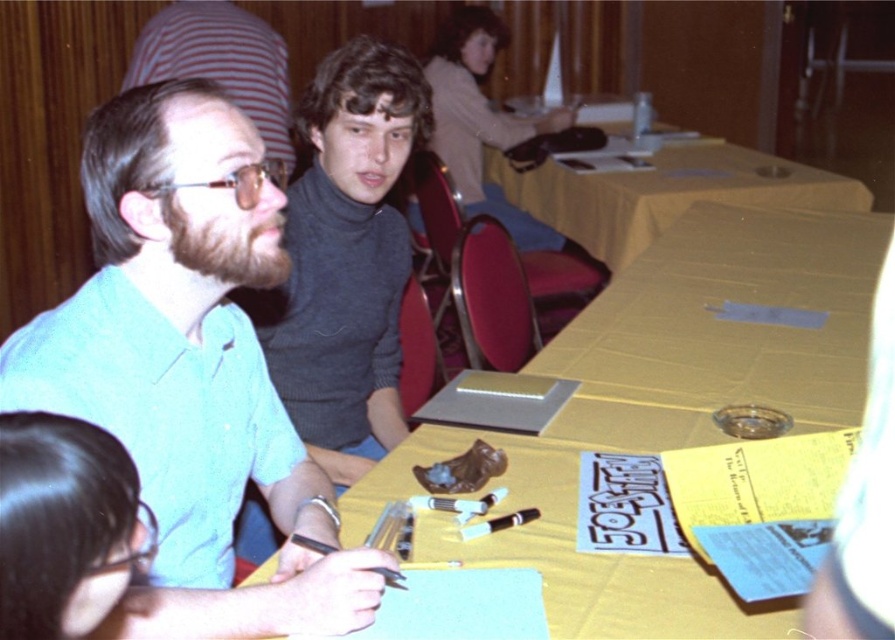
You are attending an indoor event and need to sit down. There is a black hair at lower left and a yellow fabric table at center. Which one is closer to the floor?

The black hair at lower left is shorter than the yellow fabric table at center, so the black hair at lower left is closer to the floor.

You are standing in the room and want to walk to both points. Which point, point (128, 566) or point (472, 100), will you reach first?

Point (128, 566) is closer to the viewer than point (472, 100), so you will reach point (128, 566) first.

You are a guest at this event and need to place a small object on the surface between the yellow paper at center and the matte green shirt at upper left. Which surface should you choose if you want to place it on the taller one?

The yellow paper at center has a greater height compared to the matte green shirt at upper left, so you should place the object on the yellow paper at center.